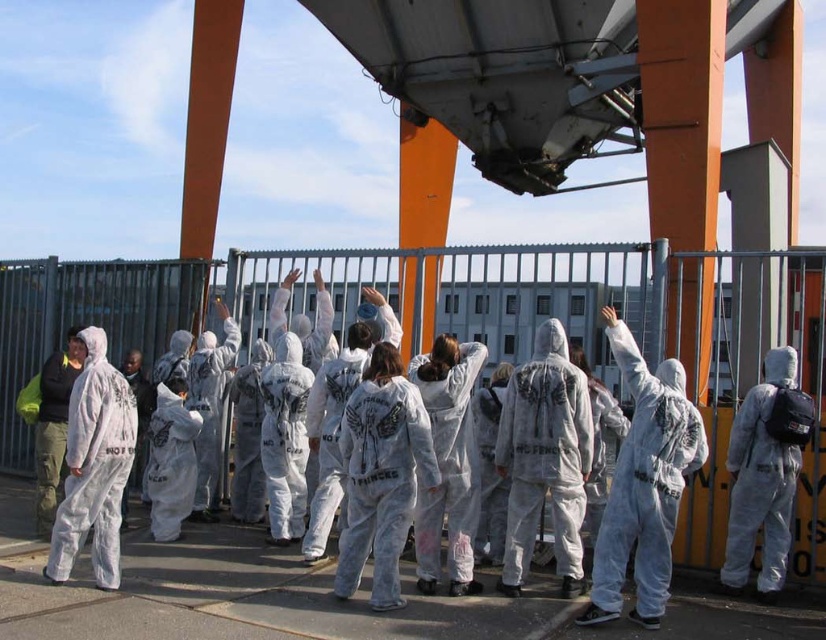
You are a photographer trying to capture a group photo of the white matte jumpsuit at center and the dark green fabric jacket at left. The camera you are using has a maximum focus range of 20 feet. Will you be able to capture both subjects clearly in the same photo?

The white matte jumpsuit at center and the dark green fabric jacket at left are 21.73 feet apart from each other. Since the camera has a maximum focus range of 20 feet, it will not be able to capture both subjects clearly in the same photo because the distance exceeds the camera limit.

You are a photographer trying to capture a clear shot of both the white matte jumpsuit at center and the dark green fabric jacket at left. Given their height difference, which one will appear larger in the photo?

The white matte jumpsuit at center will appear larger in the photo because it is much taller than the dark green fabric jacket at left.